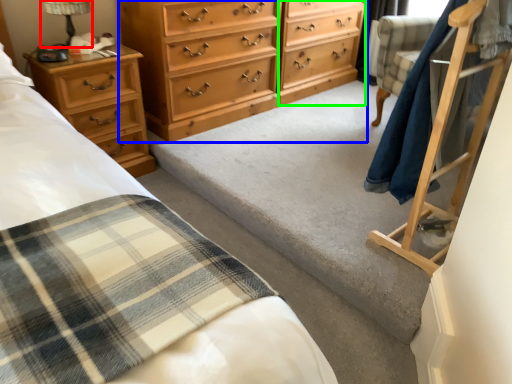
Question: Based on their relative distances, which object is nearer to table lamp (highlighted by a red box)? Choose from chest of drawers (highlighted by a blue box) and file cabinet (highlighted by a green box).

Choices:
 (A) chest of drawers
 (B) file cabinet

Answer: (A)